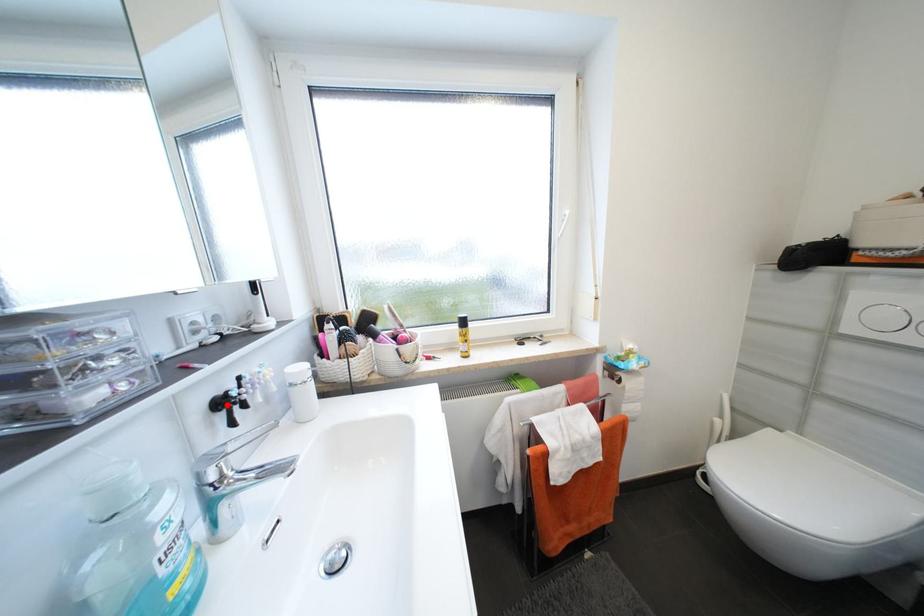
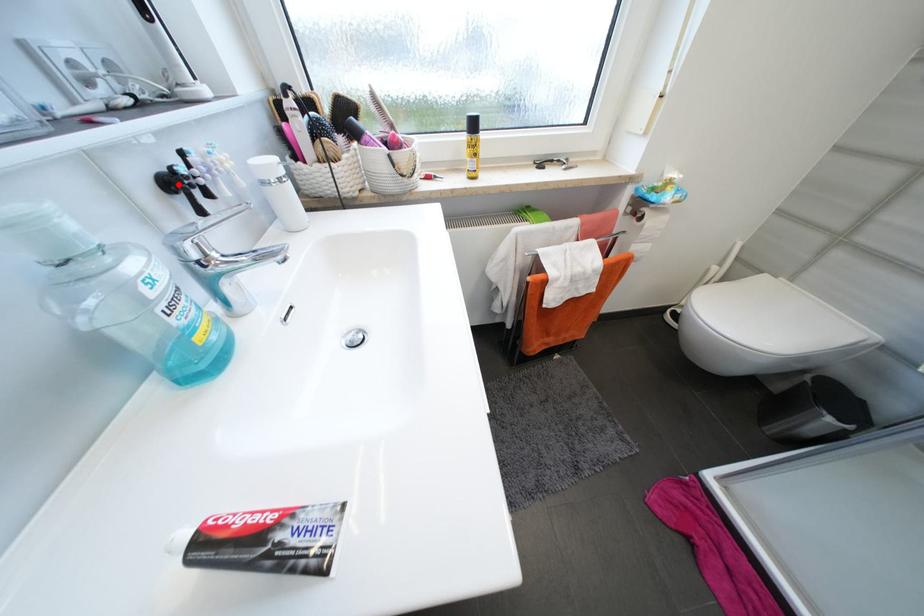
I am providing you with two images of the same scene from different viewpoints. A red point is marked on the first image and another point is marked on the second image. Is the marked point in image1 the same physical position as the marked point in image2?

Yes